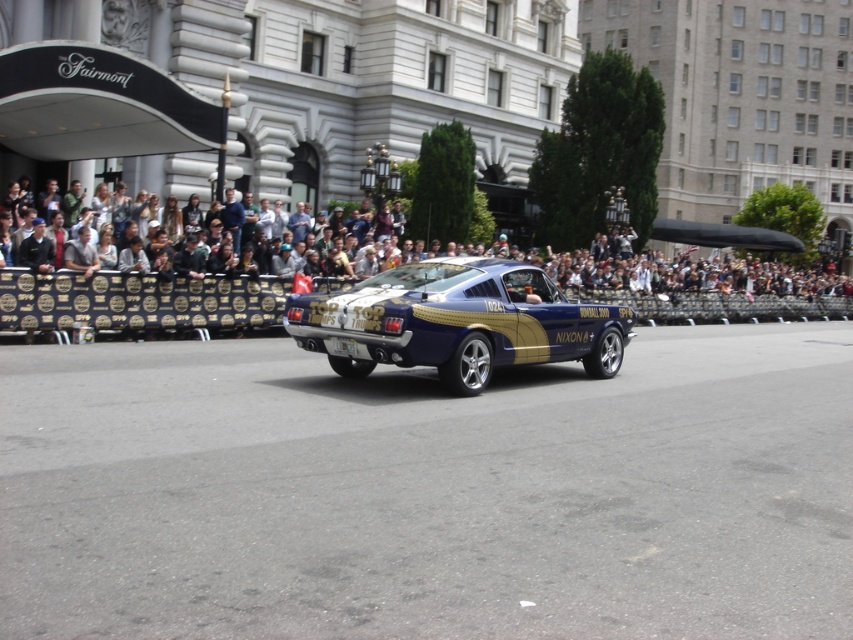
Which is behind, point (532, 538) or point (207, 257)?

Point (207, 257)

Which is more to the right, smooth asphalt road at center or dark gray crowd at upper center?

From the viewer's perspective, dark gray crowd at upper center appears more on the right side.

Where is `smooth asphalt road at center`? Image resolution: width=853 pixels, height=640 pixels. smooth asphalt road at center is located at coordinates (428, 492).

From the picture: Does shiny metallic car at center come in front of dark gray crowd at upper center?

Yes, shiny metallic car at center is in front of dark gray crowd at upper center.

Can you confirm if shiny metallic car at center is positioned to the left of dark gray crowd at upper center?

Yes, shiny metallic car at center is to the left of dark gray crowd at upper center.

Does point (405, 285) come behind point (677, 268)?

No, (405, 285) is in front of (677, 268).

Find the location of `shiny metallic car at center`. shiny metallic car at center is located at coordinates (457, 323).

Is point (345, 500) less distant than point (432, 291)?

Yes.

Does smooth asphalt road at center have a smaller size compared to shiny metallic car at center?

No.

Which is behind, point (48, 400) or point (601, 346)?

Positioned behind is point (601, 346).

This screenshot has height=640, width=853. I want to click on smooth asphalt road at center, so pos(428,492).